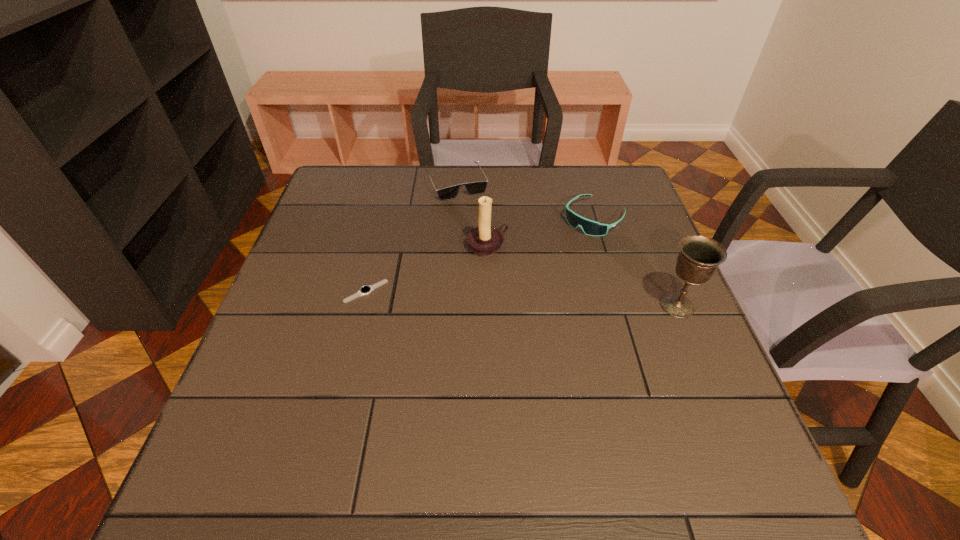
I want to click on vacant space positioned on the front-facing side of the taller sunglasses, so click(x=512, y=295).

Locate an element on the screen. The image size is (960, 540). free point located 0.230m on the front-facing side of the taller sunglasses is located at coordinates (527, 281).

What are the coordinates of `free region located on the front-facing side of the taller sunglasses` in the screenshot? It's located at (490, 315).

At what (x,y) coordinates should I click in order to perform the action: click on blank area located on the front-facing side of the fourth tallest object. Please return your answer as a coordinate pair (x, y). Looking at the image, I should click on (492, 253).

Find the location of `blank area located on the front-facing side of the fourth tallest object`. blank area located on the front-facing side of the fourth tallest object is located at coordinates (513, 292).

Locate an element on the screen. vacant area situated 0.060m on the front-facing side of the fourth tallest object is located at coordinates (471, 213).

Where is `blank space located 0.110m on the wick of the candle holder`? Image resolution: width=960 pixels, height=540 pixels. blank space located 0.110m on the wick of the candle holder is located at coordinates (530, 282).

You are a GUI agent. You are given a task and a screenshot of the screen. Output one action in this format:
    pyautogui.click(x=<x>, y=<y>)
    Task: Click on the vacant space located on the wick of the candle holder
    
    Given the screenshot: What is the action you would take?
    pyautogui.click(x=548, y=296)

Find the location of a particular element. Image resolution: width=960 pixels, height=540 pixels. free point located 0.200m on the wick of the candle holder is located at coordinates (557, 304).

The image size is (960, 540). In order to click on object at the left edge in this screenshot , I will do point(364,290).